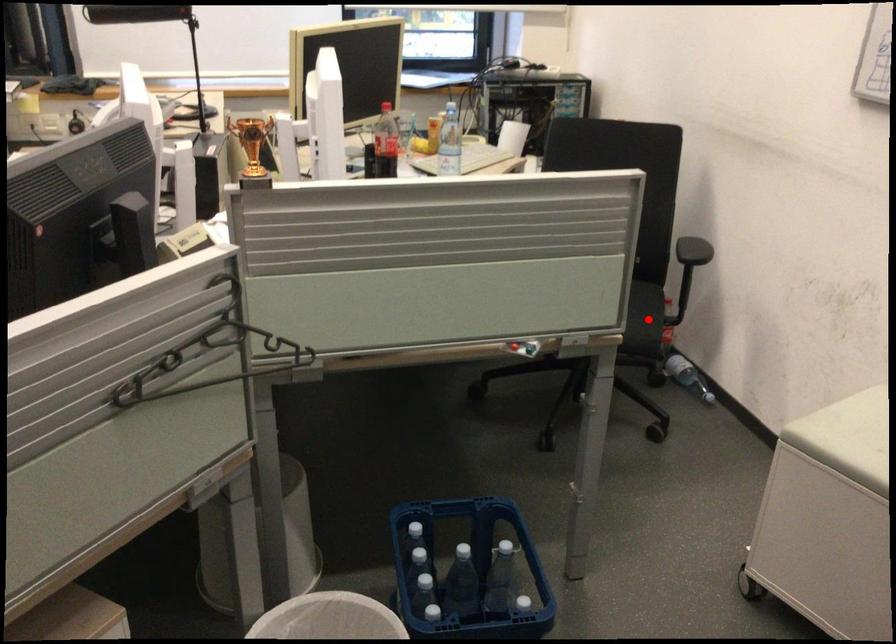
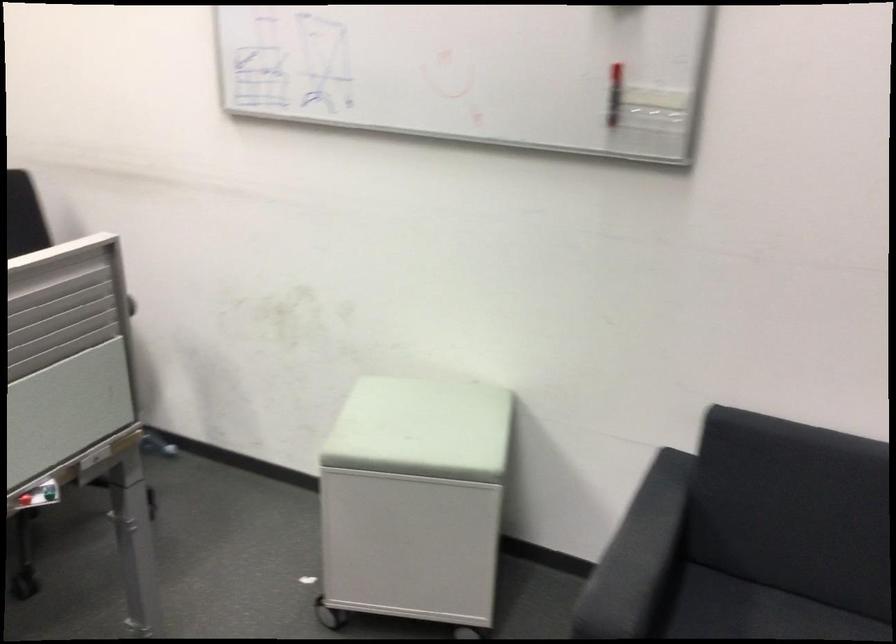
Question: I am providing you with two images of the same scene from different viewpoints. A red point is marked on the first image. Can you still see the location of the red point in image 2?

Choices:
 (A) Yes
 (B) No

Answer: (B)